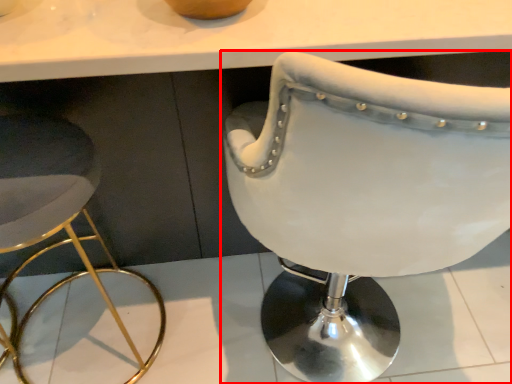
Question: From the image's perspective, what is the correct spatial relationship of chair (annotated by the red box) in relation to stool?

Choices:
 (A) above
 (B) below

Answer: (A)